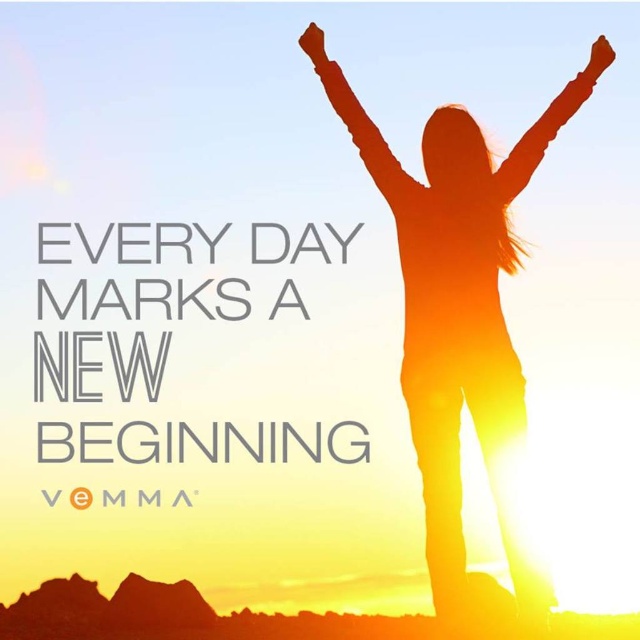
You are an artist trying to paint this scene. You want to ensure that the two points, point [516,182] and point [301,33], are accurately placed in terms of depth. Which point should you draw closer to the foreground?

Point [516,182] should be drawn closer to the foreground because it is closer to the viewer than point [301,33] according to the description.

You are a photographer trying to capture the orange matte arm at upper center in your shot. You want to ensure the arm is in focus while keeping the sunset backdrop blurred. If your camera has a depth of field setting that can blur objects beyond a certain distance, what distance should you set it to?

The orange matte arm at upper center is 8.46 meters away from viewer. To keep it in focus while blurring the background, set the depth of field to focus on objects at 8.46 meters or closer.